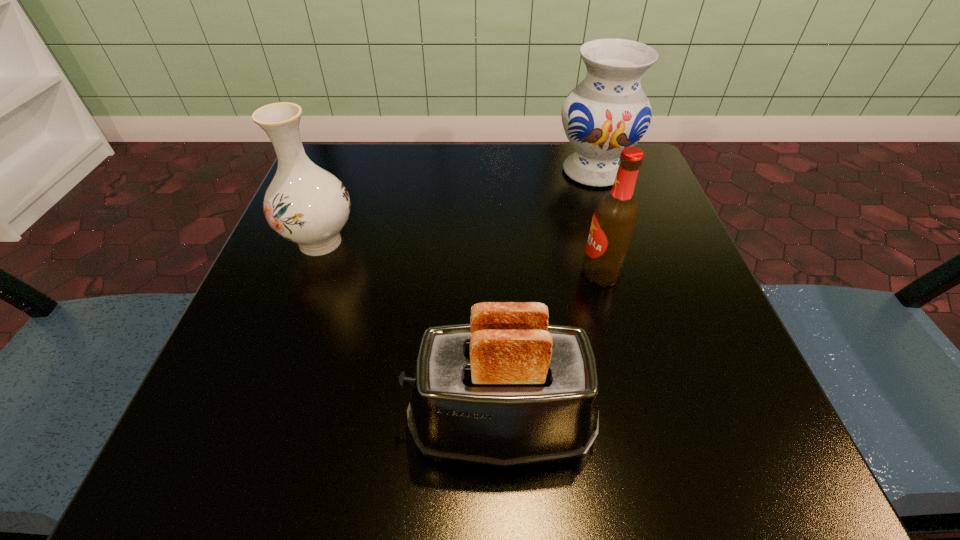
This screenshot has width=960, height=540. I want to click on the farther vase, so click(x=608, y=111).

This screenshot has width=960, height=540. I want to click on the right vase, so click(x=608, y=111).

Find the location of `the leftmost object`. the leftmost object is located at coordinates (x=304, y=203).

Locate an element on the screen. Image resolution: width=960 pixels, height=540 pixels. the nearer vase is located at coordinates (304, 203).

Identify the location of beer bottle. The width and height of the screenshot is (960, 540). (614, 220).

Locate an element on the screen. toaster is located at coordinates (507, 389).

The image size is (960, 540). In order to click on the nearest object in this screenshot , I will do `click(507, 389)`.

At what (x,y) coordinates should I click in order to perform the action: click on vacant space located on the front of the farther vase. Please return your answer as a coordinate pair (x, y). The height and width of the screenshot is (540, 960). Looking at the image, I should click on (644, 327).

Find the location of a particular element. vacant space located 0.220m on the front of the leftmost object is located at coordinates [x=267, y=382].

Find the location of a particular element. This screenshot has width=960, height=540. free location located 0.080m on the front of the beer bottle is located at coordinates pyautogui.click(x=614, y=326).